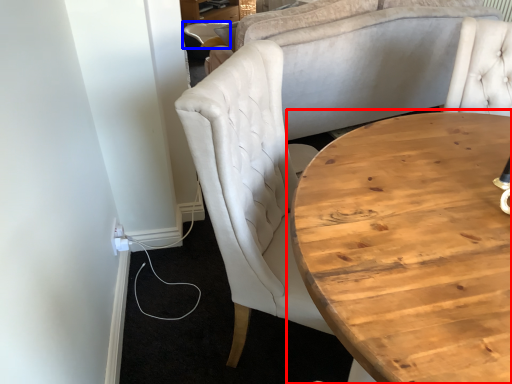
Question: Which object is further to the camera taking this photo, coffee table (highlighted by a red box) or chair (highlighted by a blue box)?

Choices:
 (A) coffee table
 (B) chair

Answer: (B)